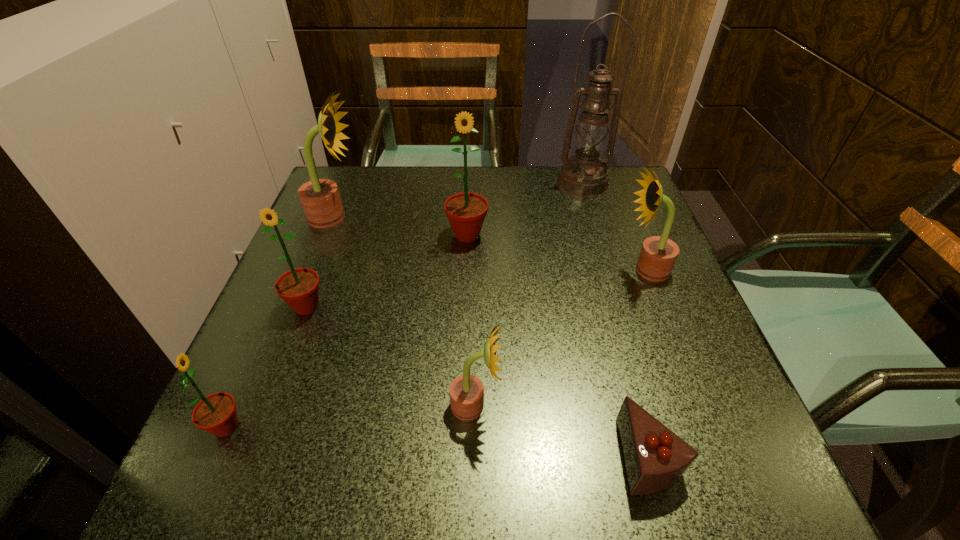
I want to click on free spot located 0.250m on the face of the second biggest green sunflower, so click(x=252, y=451).

Locate an element on the screen. This screenshot has width=960, height=540. blank space located 0.240m on the face of the smallest yellow sunflower is located at coordinates (648, 406).

The height and width of the screenshot is (540, 960). I want to click on vacant space located 0.290m on the face of the smallest green sunflower, so click(433, 427).

The height and width of the screenshot is (540, 960). Find the location of `free location located on the back of the shortest object`. free location located on the back of the shortest object is located at coordinates pos(592,255).

The width and height of the screenshot is (960, 540). I want to click on oil lamp positioned at the far edge, so click(x=584, y=175).

Find the location of a particular element. Image resolution: width=960 pixels, height=540 pixels. sunflower located at the far edge is located at coordinates (320, 198).

The height and width of the screenshot is (540, 960). I want to click on sunflower located in the near edge section of the desktop, so click(216, 413).

What are the coordinates of `chocolate cake at the near edge` in the screenshot? It's located at (655, 458).

Where is `oil lamp that is at the right edge`? oil lamp that is at the right edge is located at coordinates (584, 175).

I want to click on sunflower situated at the right edge, so pos(658,254).